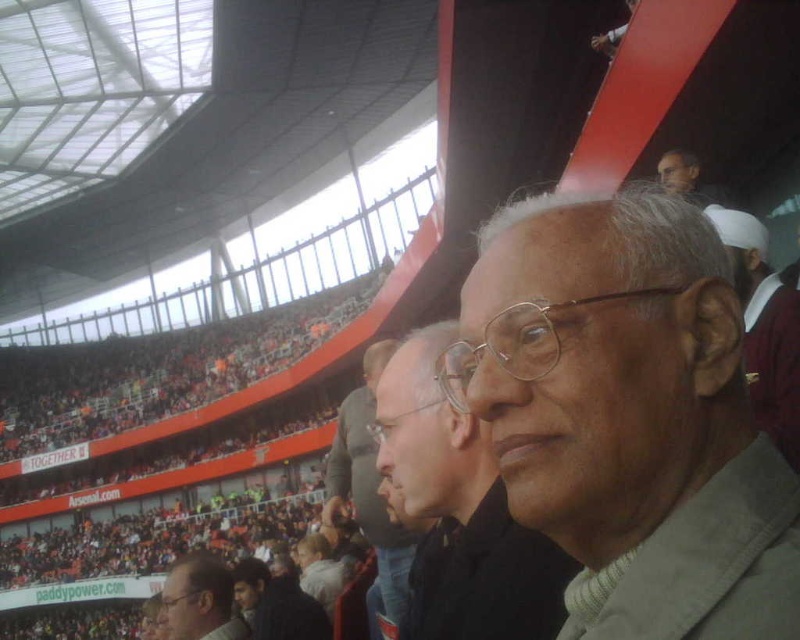
Question: Which of the following is the farthest from the observer?

Choices:
 (A) (484, 481)
 (B) (658, 177)
 (C) (705, 534)

Answer: (B)

Question: Is matte gray jacket at center further to the viewer compared to light brown hair at lower left?

Choices:
 (A) no
 (B) yes

Answer: (A)

Question: Which point is closer to the camera taking this photo?

Choices:
 (A) (684, 188)
 (B) (440, 522)

Answer: (B)

Question: Does brown textured jacket at center have a lesser width compared to light brown leather jacket at center?

Choices:
 (A) no
 (B) yes

Answer: (A)

Question: Which point appears closest to the camera in this image?

Choices:
 (A) (788, 362)
 (B) (528, 616)
 (C) (374, 477)
 (D) (165, 600)

Answer: (B)

Question: Is light brown hair at lower left to the right of smooth skin face at upper right from the viewer's perspective?

Choices:
 (A) yes
 (B) no

Answer: (B)